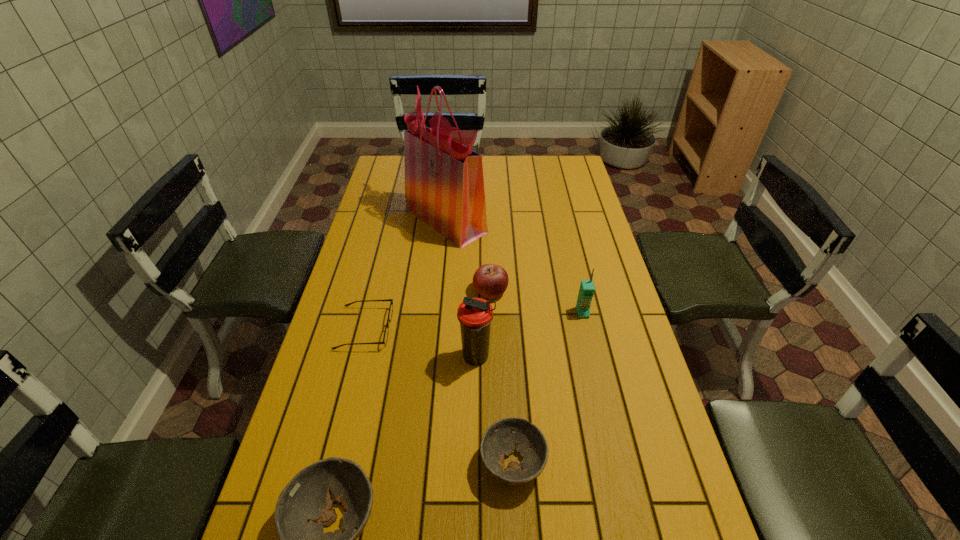
I want to click on vacant space located on the front-facing side of the shortest object, so click(495, 328).

Locate an element on the screen. The image size is (960, 540). free space located 0.220m on the right of the sixth nearest object is located at coordinates (576, 291).

Where is `free point located on the front of the shopping bag`? The height and width of the screenshot is (540, 960). free point located on the front of the shopping bag is located at coordinates (441, 275).

Where is `vacant space located on the keypad of the cellular telephone`? The width and height of the screenshot is (960, 540). vacant space located on the keypad of the cellular telephone is located at coordinates (596, 374).

Where is `free spot located on the right of the thermos bottle`? This screenshot has width=960, height=540. free spot located on the right of the thermos bottle is located at coordinates point(555,357).

Where is `spectacles situated at the left edge`? The height and width of the screenshot is (540, 960). spectacles situated at the left edge is located at coordinates (385, 337).

Image resolution: width=960 pixels, height=540 pixels. I want to click on shopping bag present at the left edge, so click(x=444, y=185).

The width and height of the screenshot is (960, 540). Identify the location of object positioned at the right edge. (586, 292).

Locate an element on the screen. The width and height of the screenshot is (960, 540). vacant space at the far edge is located at coordinates (533, 172).

In the image, there is a desktop. Where is `vacant space at the left edge`? vacant space at the left edge is located at coordinates (309, 404).